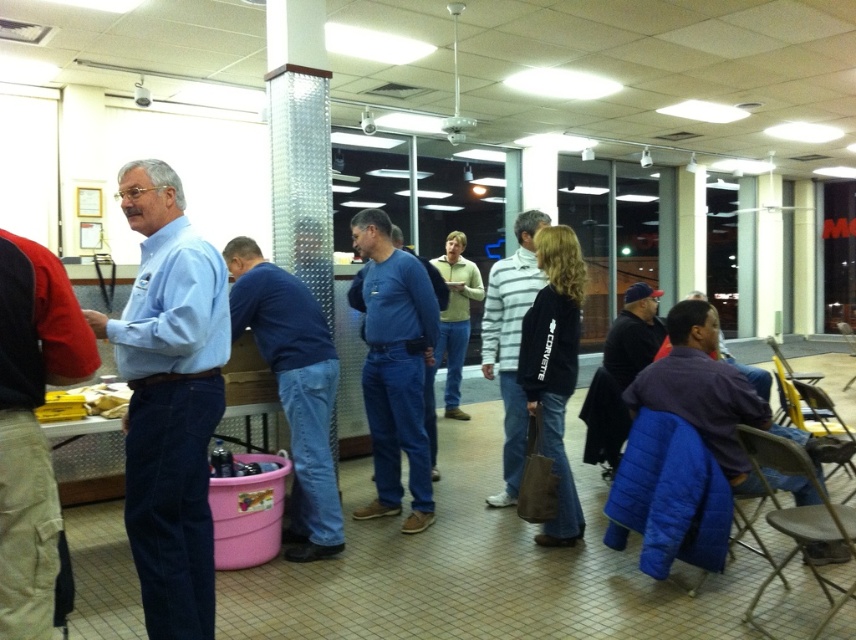
Is blue jeans at center closer to the viewer compared to purple cotton shirt at lower right?

Yes.

Which is in front, point (397, 403) or point (667, 339)?

Point (397, 403) is in front.

Between point (396, 252) and point (746, 376), which one is positioned behind?

The point (746, 376) is more distant.

Find the location of a particular element. Image resolution: width=856 pixels, height=640 pixels. blue jeans at center is located at coordinates coord(394,365).

Does point (46, 301) come closer to viewer compared to point (652, 308)?

Yes, it is.

Is point (1, 240) more distant than point (639, 292)?

No.

Is point (21, 460) closer to viewer compared to point (633, 376)?

Yes, point (21, 460) is in front of point (633, 376).

The height and width of the screenshot is (640, 856). In order to click on light blue shirt at left in this screenshot , I will do `click(33, 426)`.

Is light blue shirt at center closer to camera compared to purple cotton shirt at lower right?

Yes, it is in front of purple cotton shirt at lower right.

Measure the distance from light blue shirt at center to purple cotton shirt at lower right.

9.24 feet

The width and height of the screenshot is (856, 640). Identify the location of light blue shirt at center. point(169,401).

Where is `light blue shirt at center`? The image size is (856, 640). light blue shirt at center is located at coordinates (169, 401).